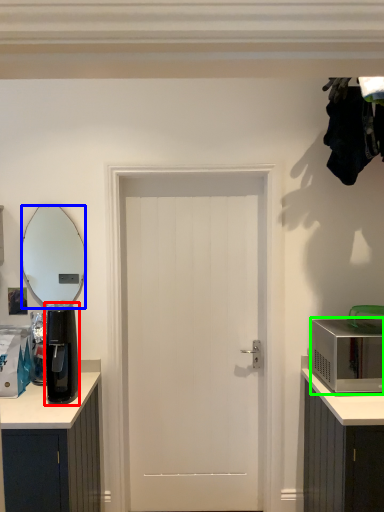
Question: Estimate the real-world distances between objects in this image. Which object is closer to appliance (highlighted by a red box), mirror (highlighted by a blue box) or microwave oven (highlighted by a green box)?

Choices:
 (A) mirror
 (B) microwave oven

Answer: (B)